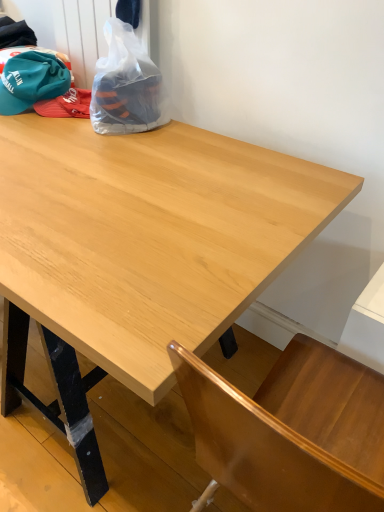
Describe the element at coordinates (141, 244) in the screenshot. I see `light wood table at center` at that location.

What is the approximate width of light wood table at center?

It is 22.48 inches.

The height and width of the screenshot is (512, 384). Find the location of `transparent plastic bag at upper left`. transparent plastic bag at upper left is located at coordinates (127, 86).

Which of these two, teal fabric baseball hat at upper left or light wood table at center, stands taller?

light wood table at center.

From the image's perspective, is teal fabric baseball hat at upper left above or below light wood table at center?

Clearly, from the image's perspective, teal fabric baseball hat at upper left is above light wood table at center.

Is teal fabric baseball hat at upper left smaller than light wood table at center?

Indeed, teal fabric baseball hat at upper left has a smaller size compared to light wood table at center.

Would you consider transparent plastic bag at upper left to be distant from teal fabric baseball hat at upper left?

No, transparent plastic bag at upper left is in close proximity to teal fabric baseball hat at upper left.

Is transparent plastic bag at upper left thinner than teal fabric baseball hat at upper left?

Incorrect, the width of transparent plastic bag at upper left is not less than that of teal fabric baseball hat at upper left.

Which point is more distant from viewer, (142, 50) or (55, 76)?

The point (55, 76) is more distant.

From the image's perspective, between transparent plastic bag at upper left and teal fabric baseball hat at upper left, which one is located above?

From the image's view, teal fabric baseball hat at upper left is above.

In the scene shown: Does teal fabric baseball hat at upper left have a smaller size compared to transparent plastic bag at upper left?

Yes.

Is teal fabric baseball hat at upper left facing towards transparent plastic bag at upper left?

Answer: No, teal fabric baseball hat at upper left is not oriented towards transparent plastic bag at upper left.

Would you say teal fabric baseball hat at upper left is to the left or to the right of transparent plastic bag at upper left in the picture?

Clearly, teal fabric baseball hat at upper left is on the left of transparent plastic bag at upper left in the image.

What's the angular difference between light wood table at center and transparent plastic bag at upper left's facing directions?

The angle between the facing direction of light wood table at center and the facing direction of transparent plastic bag at upper left is 180 degrees.

Can you confirm if light wood table at center is thinner than transparent plastic bag at upper left?

No, light wood table at center is not thinner than transparent plastic bag at upper left.

Which is more to the left, light wood table at center or transparent plastic bag at upper left?

transparent plastic bag at upper left.

Can you confirm if light wood table at center is taller than transparent plastic bag at upper left?

Indeed, light wood table at center has a greater height compared to transparent plastic bag at upper left.

From a real-world perspective, between light wood table at center and teal fabric baseball hat at upper left, who is vertically lower?

From a 3D spatial view, light wood table at center is below.

Is light wood table at center inside the boundaries of teal fabric baseball hat at upper left, or outside?

The correct answer is: outside.

Identify the location of baseball hat that is above the light wood table at center (from the image's perspective). (31, 80).

Locate an element on the screen. plastic bag that appears behind the light wood table at center is located at coordinates (127, 86).

Between point (112, 128) and point (238, 218), which one is positioned in front?

The point (238, 218) is closer.

Considering the sizes of objects transparent plastic bag at upper left and light wood table at center in the image provided, who is bigger, transparent plastic bag at upper left or light wood table at center?

light wood table at center.

Is transparent plastic bag at upper left in front of or behind light wood table at center in the image?

transparent plastic bag at upper left is behind light wood table at center.

Where is `baseball hat located above the light wood table at center (from a real-world perspective)`? baseball hat located above the light wood table at center (from a real-world perspective) is located at coordinates (31, 80).

The width and height of the screenshot is (384, 512). Find the location of `baseball hat behind the transparent plastic bag at upper left`. baseball hat behind the transparent plastic bag at upper left is located at coordinates (31, 80).

Which object lies further to the anchor point teal fabric baseball hat at upper left, light wood table at center or transparent plastic bag at upper left?

The object further to teal fabric baseball hat at upper left is light wood table at center.

Based on their spatial positions, is transparent plastic bag at upper left or teal fabric baseball hat at upper left closer to light wood table at center?

The object closer to light wood table at center is transparent plastic bag at upper left.

When comparing their distances from teal fabric baseball hat at upper left, does transparent plastic bag at upper left or light wood table at center seem closer?

transparent plastic bag at upper left lies closer to teal fabric baseball hat at upper left than the other object.

Considering their positions, is teal fabric baseball hat at upper left positioned further to transparent plastic bag at upper left than light wood table at center?

Based on the image, light wood table at center appears to be further to transparent plastic bag at upper left.

Estimate the real-world distances between objects in this image. Which object is closer to light wood table at center, teal fabric baseball hat at upper left or transparent plastic bag at upper left?

Among the two, transparent plastic bag at upper left is located nearer to light wood table at center.

Based on their spatial positions, is light wood table at center or teal fabric baseball hat at upper left further from transparent plastic bag at upper left?

light wood table at center is further to transparent plastic bag at upper left.

Identify the location of plastic bag between teal fabric baseball hat at upper left and light wood table at center vertically. The height and width of the screenshot is (512, 384). (127, 86).